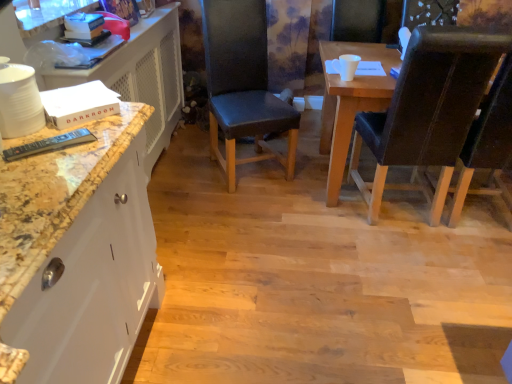
What are the coordinates of `free spot in front of black leather chair at center, which is the 1th chair in left-to-right order` in the screenshot? It's located at (244, 207).